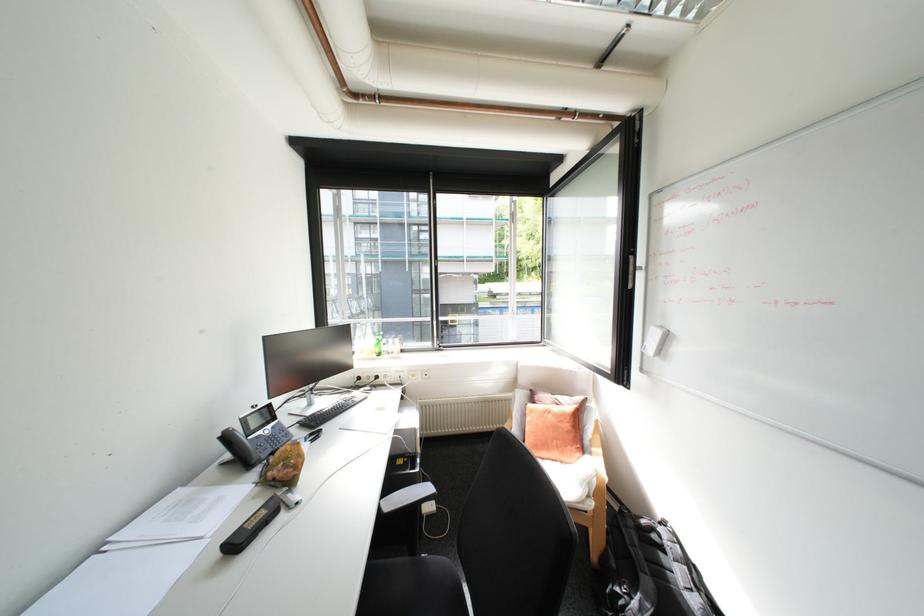
Locate an element on the screen. The image size is (924, 616). window handle is located at coordinates (629, 270).